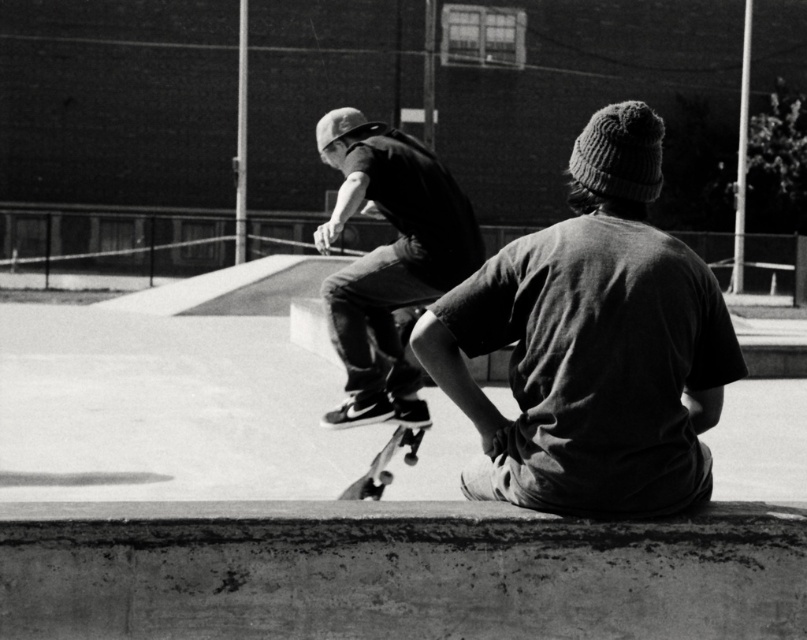
You are a photographer trying to capture a photo of the knit cap at center and the smooth black skateboard at center in the same frame. Your camera has a maximum focus range of 3 meters. Will you be able to include both objects in focus?

The distance between the knit cap at center and the smooth black skateboard at center is 2.99 meters, which is within the camera maximum focus range of 3 meters. Therefore, you can include both objects in focus.

In the scene shown: You are a photographer who wants to capture the skateboarder landing on the matte black skateboard at center. However, there is another smooth black skateboard at center in the scene. Which skateboard should you focus on to ensure you capture the correct one?

The matte black skateboard at center is located above the smooth black skateboard at center, so you should focus on the one that is higher in the frame to capture the correct one.